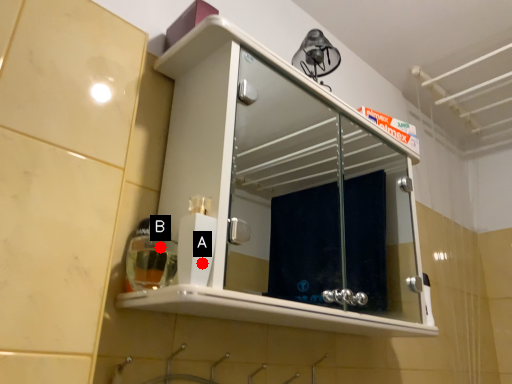
Question: Two points are circled on the image, labeled by A and B beside each circle. Which point is farther from the camera taking this photo?

Choices:
 (A) A is further
 (B) B is further

Answer: (B)